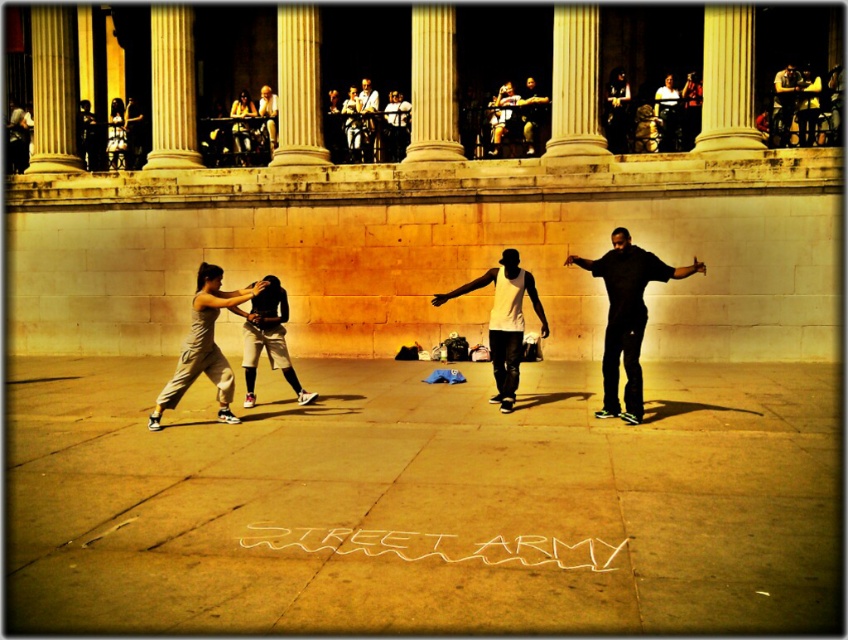
Question: Which point appears closest to the camera in this image?

Choices:
 (A) (523, 122)
 (B) (462, 292)
 (C) (159, 472)
 (D) (674, 122)

Answer: (C)

Question: Which object is positioned farthest from the concrete sidewalk at center?

Choices:
 (A) matte black tank top at center
 (B) gray fabric pants at lower left

Answer: (A)

Question: Which of the following is the closest to the observer?

Choices:
 (A) (678, 115)
 (B) (232, 490)

Answer: (B)

Question: Is concrete sidewalk at center above dark blue jeans at center?

Choices:
 (A) yes
 (B) no

Answer: (B)

Question: Does white matte tank top at center appear under dark blue jeans at center?

Choices:
 (A) yes
 (B) no

Answer: (A)

Question: Does matte black tank top at center have a lesser width compared to light brown leather jacket at center?

Choices:
 (A) no
 (B) yes

Answer: (A)